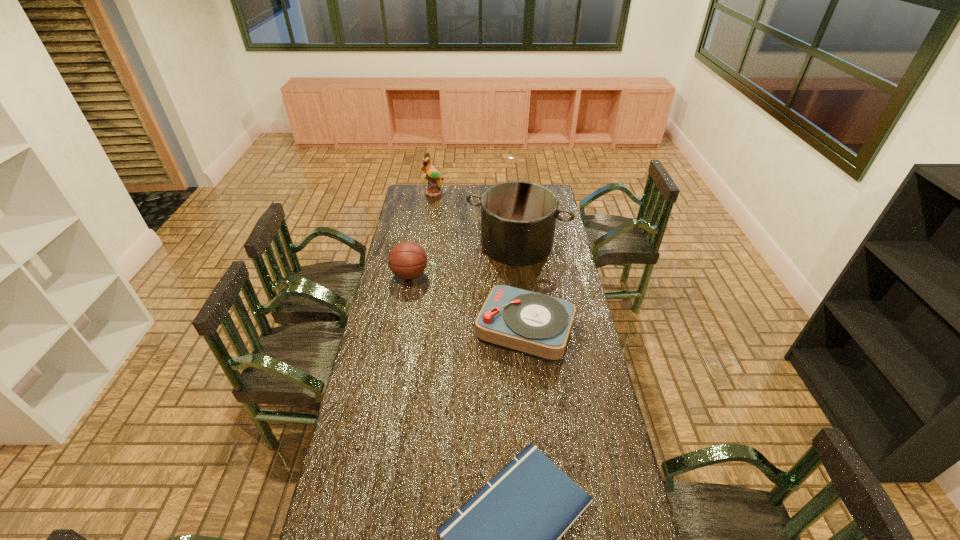
This screenshot has height=540, width=960. I want to click on vacant space in between the third shortest object and the pan, so click(463, 260).

Locate an element on the screen. The width and height of the screenshot is (960, 540). free area in between the fourth farthest object and the basketball is located at coordinates click(x=468, y=302).

Point out which object is positioned as the nearest to the shortest object. Please provide its 2D coordinates. Your answer should be formatted as a tuple, i.e. [(x, y)], where the tuple contains the x and y coordinates of a point satisfying the conditions above.

[(539, 325)]

Identify which object is the fourth closest to the second shortest object. Please provide its 2D coordinates. Your answer should be formatted as a tuple, i.e. [(x, y)], where the tuple contains the x and y coordinates of a point satisfying the conditions above.

[(433, 176)]